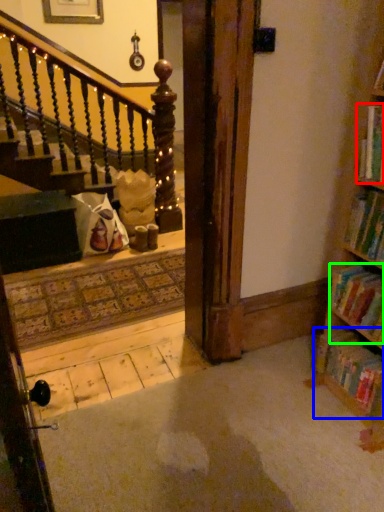
Question: Estimate the real-world distances between objects in this image. Which object is farther from book (highlighted by a red box), book (highlighted by a blue box) or book (highlighted by a green box)?

Choices:
 (A) book
 (B) book

Answer: (A)